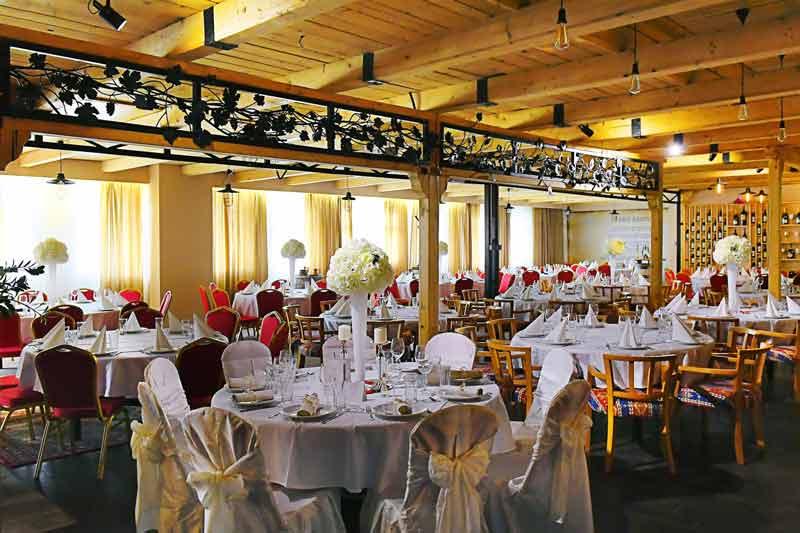
Identify the location of lights. (118, 26), (674, 151), (561, 44), (632, 87), (742, 114), (782, 138), (58, 180), (226, 190), (348, 197), (510, 207).